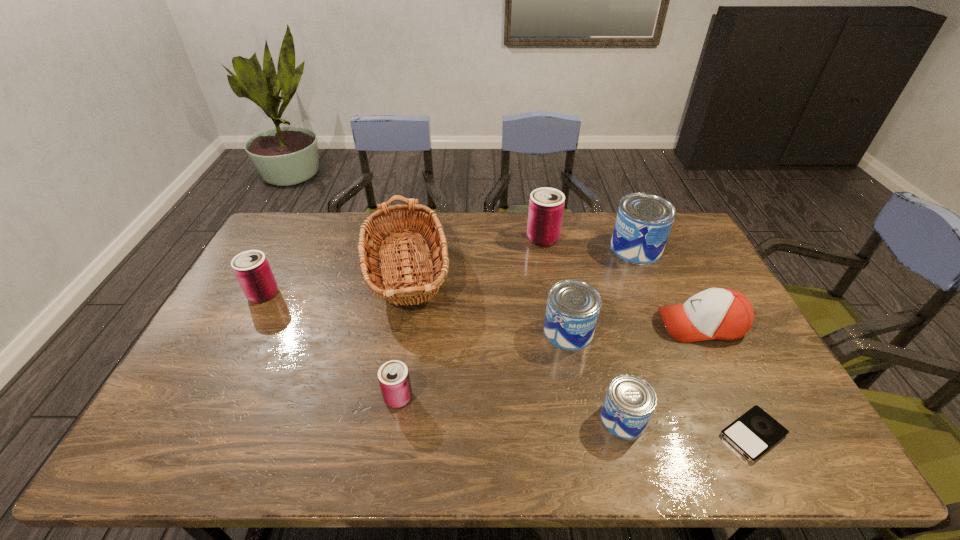
Locate an element on the screen. The height and width of the screenshot is (540, 960). object at the left edge is located at coordinates (251, 268).

Locate an element on the screen. The image size is (960, 540). can present at the right edge is located at coordinates (644, 221).

Where is `baseball cap at the right edge`? The width and height of the screenshot is (960, 540). baseball cap at the right edge is located at coordinates (723, 314).

Image resolution: width=960 pixels, height=540 pixels. Identify the location of iPod located in the right edge section of the desktop. (755, 432).

Identify the location of object that is at the far right corner. This screenshot has width=960, height=540. (644, 221).

Where is `object that is at the near right corner`? The image size is (960, 540). object that is at the near right corner is located at coordinates (755, 432).

In order to click on free space at the far edge of the desktop in this screenshot , I will do `click(324, 220)`.

What are the coordinates of `free space at the near edge of the desktop` in the screenshot? It's located at (295, 447).

This screenshot has height=540, width=960. Find the location of `vacant space at the right edge of the desktop`. vacant space at the right edge of the desktop is located at coordinates (670, 273).

Find the location of a particular element. This screenshot has width=960, height=540. free space at the far left corner of the desktop is located at coordinates (273, 233).